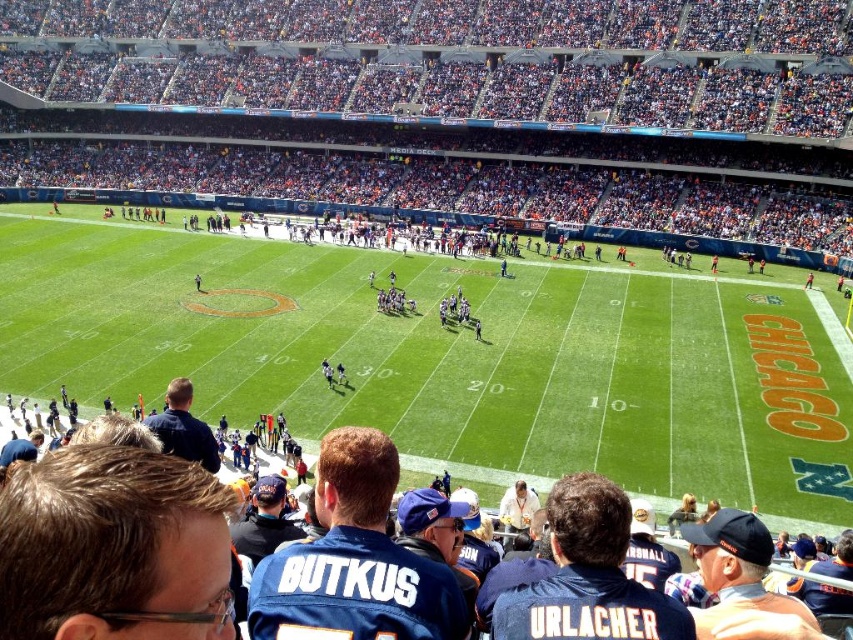
Does orange fabric seats at upper center have a larger size compared to blue jersey at center?

Indeed, orange fabric seats at upper center has a larger size compared to blue jersey at center.

Can you confirm if orange fabric seats at upper center is shorter than blue jersey at center?

In fact, orange fabric seats at upper center may be taller than blue jersey at center.

The width and height of the screenshot is (853, 640). Identify the location of orange fabric seats at upper center. (457, 104).

The image size is (853, 640). What are the coordinates of `green grass football field at center` in the screenshot? It's located at (434, 358).

Does green grass football field at center appear over blue jersey at center?

Yes, green grass football field at center is above blue jersey at center.

You are a GUI agent. You are given a task and a screenshot of the screen. Output one action in this format:
    pyautogui.click(x=<x>, y=<y>)
    Task: Click on the green grass football field at center
    The image size is (853, 640).
    Given the screenshot: What is the action you would take?
    pyautogui.click(x=434, y=358)

Can you confirm if orange fabric seats at upper center is wider than green grass football field at center?

Yes, orange fabric seats at upper center is wider than green grass football field at center.

The image size is (853, 640). What do you see at coordinates (457, 104) in the screenshot?
I see `orange fabric seats at upper center` at bounding box center [457, 104].

Which is behind, point (436, 90) or point (538, 275)?

The point (436, 90) is more distant.

Locate an element on the screen. Image resolution: width=853 pixels, height=640 pixels. orange fabric seats at upper center is located at coordinates (457, 104).